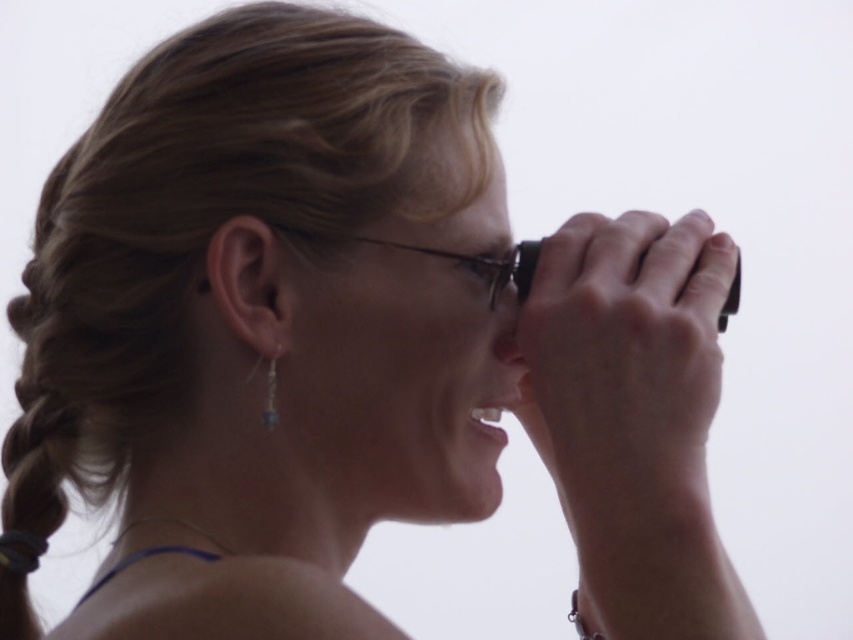
You are taking a photo of a person holding binoculars. The camera is positioned at a certain distance from the point specified as point (491, 273). If the camera needs to be at least 1 meter away to avoid distortion, is the current distance sufficient?

The distance between point (491, 273) and the camera is 84.71 centimeters, which is less than 1 meter. Therefore, the current distance is not sufficient to avoid distortion.

In the scene shown: You are an optometrist examining the clear glass eye at center and the silver metallic earring at lower left of a patient. Which object has a larger size?

The clear glass eye at center is bigger than the silver metallic earring at lower left according to the provided description.